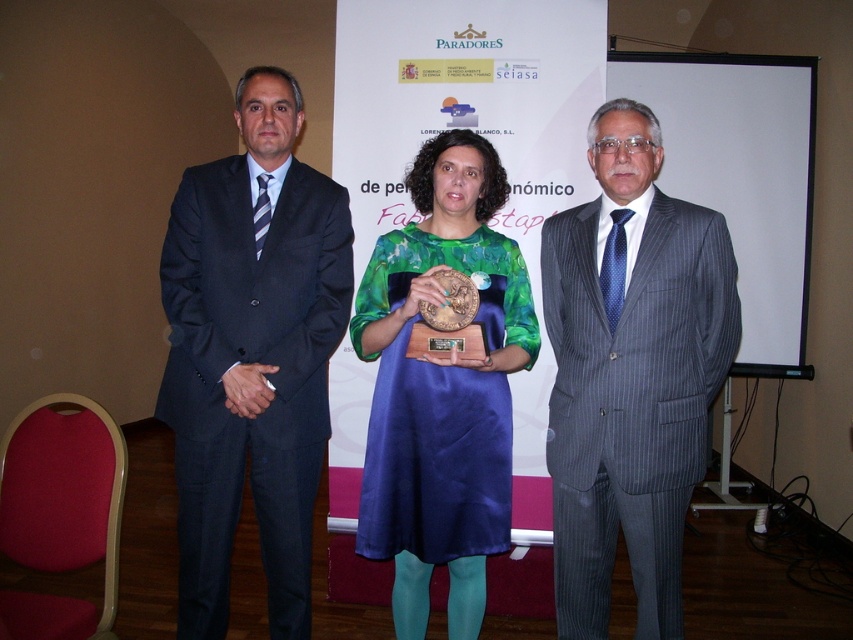
Is matte black suit at left behind gray pinstripe suit at center?

Yes, matte black suit at left is further from the viewer.

Who is higher up, matte black suit at left or gray pinstripe suit at center?

matte black suit at left

Is point (322, 356) more distant than point (668, 237)?

Yes, it is behind point (668, 237).

Identify the location of matte black suit at left. (251, 355).

In the scene shown: Does matte black suit at left appear under green satin dress at center?

No, matte black suit at left is not below green satin dress at center.

Which is more to the left, matte black suit at left or green satin dress at center?

From the viewer's perspective, matte black suit at left appears more on the left side.

Identify the location of matte black suit at left. (251, 355).

Locate an element on the screen. This screenshot has width=853, height=640. matte black suit at left is located at coordinates (251, 355).

The image size is (853, 640). What do you see at coordinates (630, 372) in the screenshot?
I see `gray pinstripe suit at center` at bounding box center [630, 372].

Is the position of gray pinstripe suit at center more distant than that of green satin dress at center?

No, gray pinstripe suit at center is closer to the viewer.

The width and height of the screenshot is (853, 640). Find the location of `gray pinstripe suit at center`. gray pinstripe suit at center is located at coordinates (630, 372).